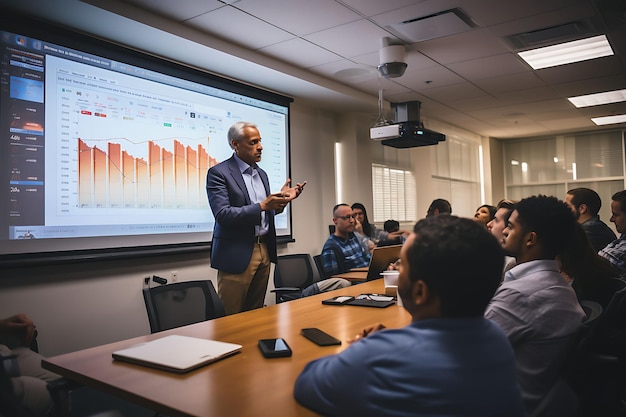
Find the location of a particular element. meeting room is located at coordinates (79, 276), (170, 387), (335, 148), (170, 172), (288, 307), (498, 157), (379, 383), (359, 232), (245, 365), (216, 301).